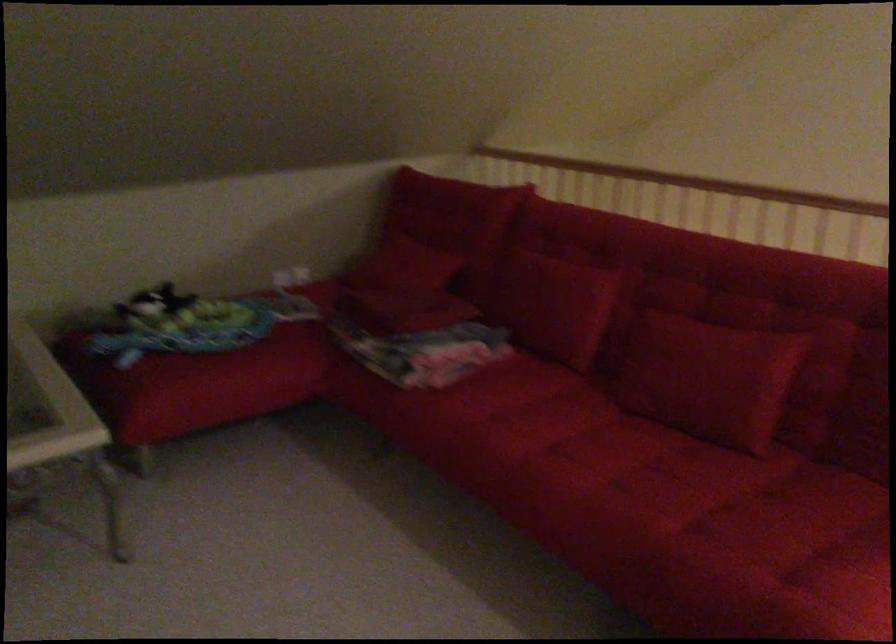
Where would you sit the sofa sitting surface? Please return your answer as a coordinate pair (x, y).

(754, 558)